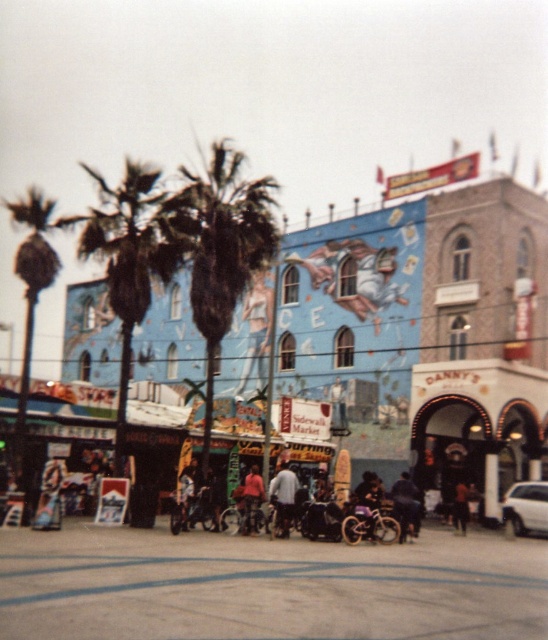
Does white matte car at lower right have a smaller size compared to denim jacket at center?

Actually, white matte car at lower right might be larger than denim jacket at center.

This screenshot has width=548, height=640. Describe the element at coordinates (527, 508) in the screenshot. I see `white matte car at lower right` at that location.

Identify the location of white matte car at lower right. (527, 508).

Is point (283, 492) more distant than point (191, 492)?

That is False.

Which is more to the left, white cotton shirt at center or denim jacket at center?

denim jacket at center is more to the left.

Which is in front, point (279, 465) or point (180, 476)?

Positioned in front is point (180, 476).

Where is `white cotton shirt at center`? white cotton shirt at center is located at coordinates (282, 499).

Can you confirm if green leafy palm tree at left is thinner than white matte car at lower right?

In fact, green leafy palm tree at left might be wider than white matte car at lower right.

Measure the distance between point (x=31, y=195) and camera.

Point (x=31, y=195) is 48.36 meters from camera.

Where is `green leafy palm tree at left`? This screenshot has height=640, width=548. green leafy palm tree at left is located at coordinates (31, 292).